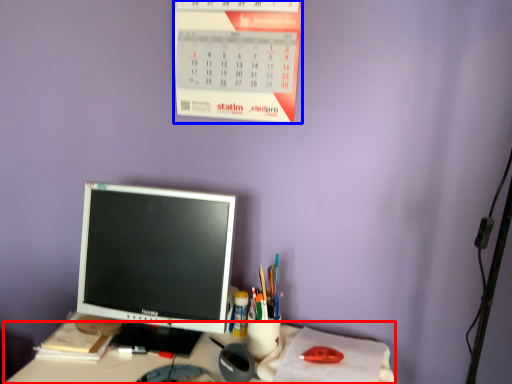
Question: Which of the following is the closest to the observer, desk (highlighted by a red box) or calendar (highlighted by a blue box)?

Choices:
 (A) desk
 (B) calendar

Answer: (A)